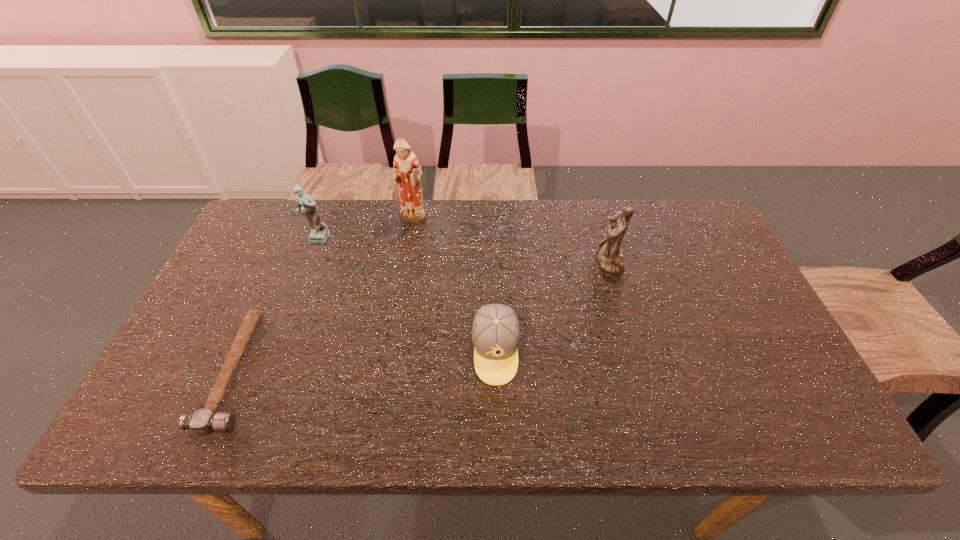
In the image, there is a desktop. At what (x,y) coordinates should I click in order to perform the action: click on vacant region at the far left corner. Please return your answer as a coordinate pair (x, y). The image size is (960, 540). Looking at the image, I should click on (265, 222).

Locate an element on the screen. The image size is (960, 540). free area in between the hammer and the second shortest object is located at coordinates (365, 361).

Locate an element on the screen. The image size is (960, 540). vacant area that lies between the shortest object and the second object from right to left is located at coordinates (365, 361).

Where is `vacant point located between the shortest object and the fourth object from left to right`? vacant point located between the shortest object and the fourth object from left to right is located at coordinates (365, 361).

Locate an element on the screen. The height and width of the screenshot is (540, 960). free space between the rightmost figurine and the tallest figurine is located at coordinates (511, 241).

Locate an element on the screen. unoccupied area between the second shortest object and the hammer is located at coordinates (365, 361).

Locate an element on the screen. free area in between the rightmost object and the tallest object is located at coordinates (511, 241).

This screenshot has width=960, height=540. I want to click on vacant area that lies between the leftmost figurine and the rightmost figurine, so click(463, 251).

At what (x,y) coordinates should I click in order to perform the action: click on free space between the shortest object and the leftmost figurine. Please return your answer as a coordinate pair (x, y). Looking at the image, I should click on (276, 306).

Where is `vacant area that lies between the rightmost figurine and the shortest object`? This screenshot has height=540, width=960. vacant area that lies between the rightmost figurine and the shortest object is located at coordinates (421, 316).